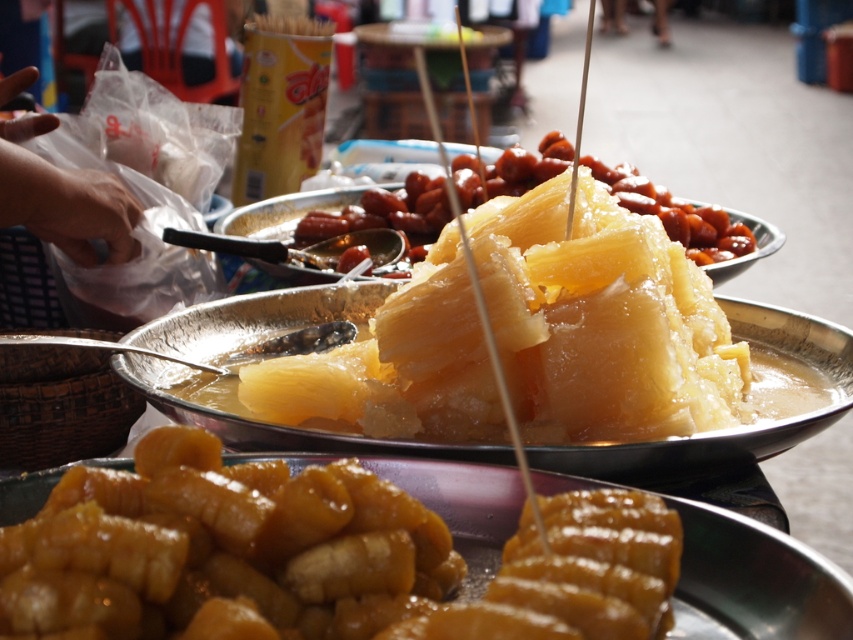
You are standing at the point closest to the viewer in the image. Which of the two points, point (540, 413) or point (314, 237), are you currently standing at?

You are standing at point (540, 413) because it is in front of point (314, 237).